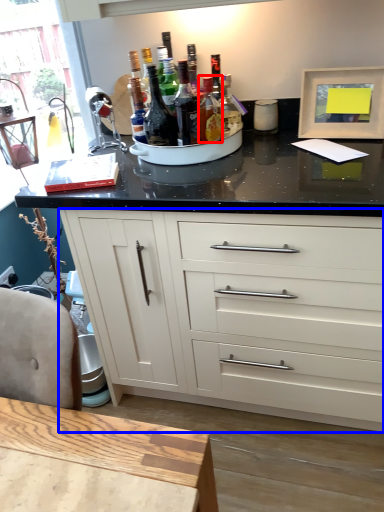
Question: Which point is closer to the camera, bottle (highlighted by a red box) or cabinetry (highlighted by a blue box)?

Choices:
 (A) bottle
 (B) cabinetry

Answer: (B)